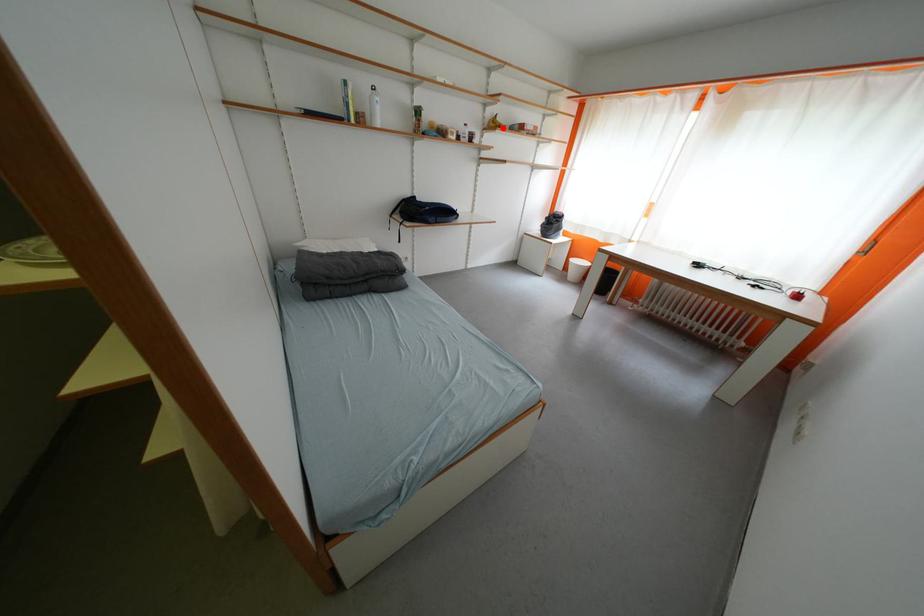
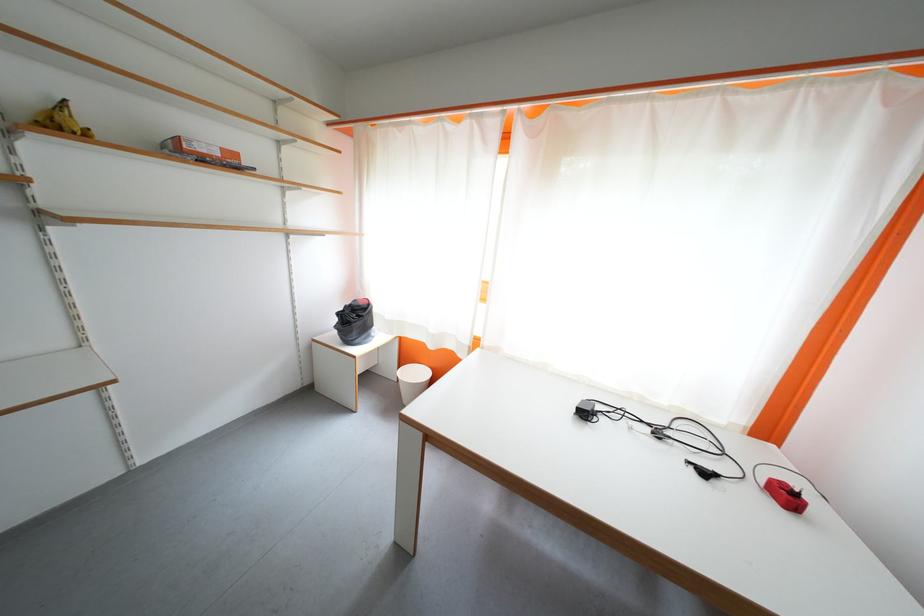
Question: A red point is marked in image1. In image2, is the corresponding 3D point closer to the camera or farther? Reply with the corresponding letter.

Choices:
 (A) The corresponding 3D point is closer.
 (B) The corresponding 3D point is farther.

Answer: (B)